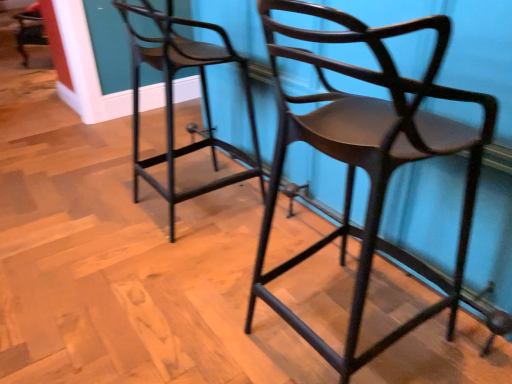
Where is `free space in front of matte black stool at center, positioned as the 1th chair in left-to-right order`? This screenshot has width=512, height=384. free space in front of matte black stool at center, positioned as the 1th chair in left-to-right order is located at coordinates (178, 265).